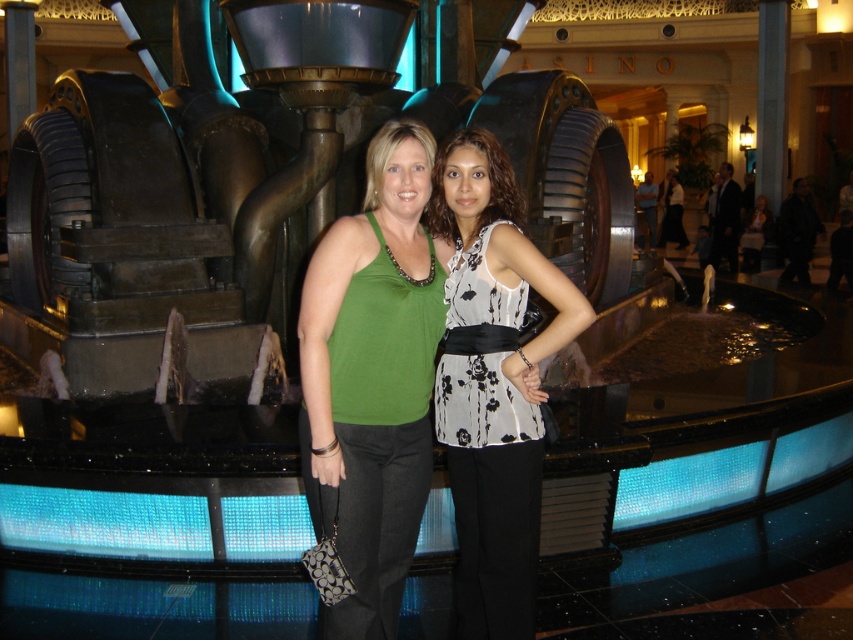
Is green fabric tank top at center thinner than floral print blouse at center?

Yes.

Is green fabric tank top at center further to the viewer compared to floral print blouse at center?

No.

Who is more distant from viewer, (335,376) or (462,577)?

Point (462,577)

Locate an element on the screen. The height and width of the screenshot is (640, 853). green fabric tank top at center is located at coordinates tap(372, 378).